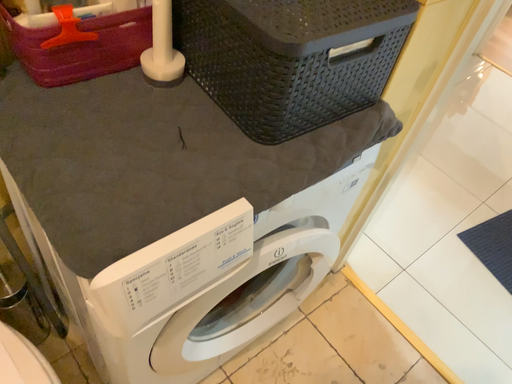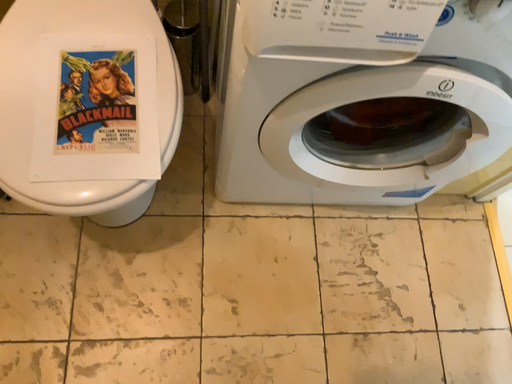
Question: Which way did the camera rotate in the video?

Choices:
 (A) rotated upward
 (B) rotated downward

Answer: (B)